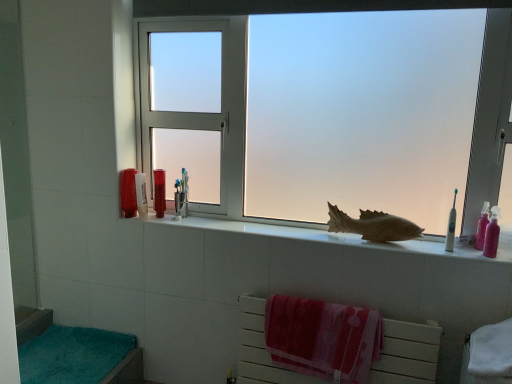
Question: From a real-world perspective, is frosted glass window at center on translucent plastic cup at upper center, arranged as the 1th toiletry when viewed from the back?

Choices:
 (A) no
 (B) yes

Answer: (B)

Question: Considering the relative positions of frosted glass window at center and translucent plastic cup at upper center, which is the third toiletry in right-to-left order, in the image provided, is frosted glass window at center behind translucent plastic cup at upper center, which is the third toiletry in right-to-left order,?

Choices:
 (A) yes
 (B) no

Answer: (B)

Question: Considering the relative sizes of frosted glass window at center and translucent plastic cup at upper center, arranged as the 1th toiletry when viewed from the back, in the image provided, is frosted glass window at center thinner than translucent plastic cup at upper center, arranged as the 1th toiletry when viewed from the back,?

Choices:
 (A) no
 (B) yes

Answer: (A)

Question: From the image's perspective, is frosted glass window at center above translucent plastic cup at upper center, which is the third toiletry in right-to-left order?

Choices:
 (A) no
 (B) yes

Answer: (B)

Question: Does frosted glass window at center have a greater height compared to translucent plastic cup at upper center, which is the third toiletry in right-to-left order?

Choices:
 (A) no
 (B) yes

Answer: (B)

Question: Can you confirm if frosted glass window at center is shorter than translucent plastic cup at upper center, the 3th toiletry from the left?

Choices:
 (A) no
 (B) yes

Answer: (A)

Question: Is translucent plastic cup at left, which is the 4th toiletry in front-to-back order, a part of white ceramic fish at center?

Choices:
 (A) no
 (B) yes

Answer: (A)

Question: Can you confirm if white ceramic fish at center is wider than translucent plastic cup at left, which is counted as the 1th toiletry, starting from the left?

Choices:
 (A) no
 (B) yes

Answer: (B)

Question: Considering the relative sizes of white ceramic fish at center and translucent plastic cup at left, the 5th toiletry in the right-to-left sequence, in the image provided, is white ceramic fish at center taller than translucent plastic cup at left, the 5th toiletry in the right-to-left sequence,?

Choices:
 (A) no
 (B) yes

Answer: (A)

Question: Can you confirm if white ceramic fish at center is positioned to the left of translucent plastic cup at left, which is the 4th toiletry in front-to-back order?

Choices:
 (A) yes
 (B) no

Answer: (B)

Question: Could you tell me if white ceramic fish at center is facing translucent plastic cup at left, the 5th toiletry in the right-to-left sequence?

Choices:
 (A) yes
 (B) no

Answer: (B)

Question: From a real-world perspective, is white ceramic fish at center located higher than translucent plastic cup at left, which is the 4th toiletry in front-to-back order?

Choices:
 (A) no
 (B) yes

Answer: (A)

Question: Considering the relative sizes of teal plush bath towel at lower left and translucent plastic container at left, which is the 3th toiletry from front to back, in the image provided, is teal plush bath towel at lower left smaller than translucent plastic container at left, which is the 3th toiletry from front to back,?

Choices:
 (A) yes
 (B) no

Answer: (B)